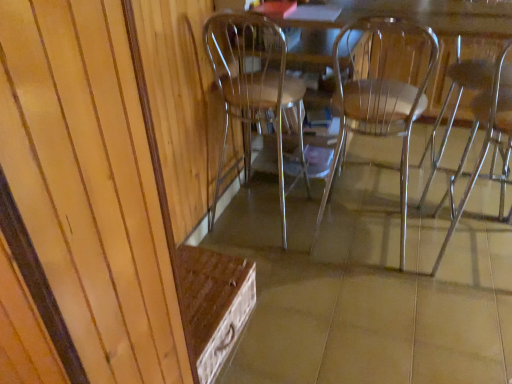
Question: Is clear plastic chair at right, positioned as the 1th chair in right-to-left order, wider than clear plastic chair at center, the third chair viewed from the right?

Choices:
 (A) no
 (B) yes

Answer: (A)

Question: Is clear plastic chair at right, positioned as the 1th chair in right-to-left order, turned away from clear plastic chair at center, the third chair viewed from the right?

Choices:
 (A) yes
 (B) no

Answer: (B)

Question: Does clear plastic chair at right, which is counted as the 4th chair, starting from the left, have a lesser height compared to clear plastic chair at center, which is the second chair from left to right?

Choices:
 (A) no
 (B) yes

Answer: (A)

Question: Considering the relative positions of clear plastic chair at right, positioned as the 1th chair in right-to-left order, and clear plastic chair at center, which is the second chair from left to right, in the image provided, is clear plastic chair at right, positioned as the 1th chair in right-to-left order, to the left of clear plastic chair at center, which is the second chair from left to right, from the viewer's perspective?

Choices:
 (A) no
 (B) yes

Answer: (A)

Question: From a real-world perspective, is clear plastic chair at right, positioned as the 1th chair in right-to-left order, under clear plastic chair at center, which is the second chair from left to right?

Choices:
 (A) yes
 (B) no

Answer: (A)

Question: Considering the positions of clear plastic chair at center, which is the second chair from left to right, and clear plastic chair at center, which is the 3th chair from left to right, in the image, is clear plastic chair at center, which is the second chair from left to right, bigger or smaller than clear plastic chair at center, which is the 3th chair from left to right,?

Choices:
 (A) big
 (B) small

Answer: (B)

Question: From the image's perspective, is clear plastic chair at center, the third chair viewed from the right, located above or below clear plastic chair at center, the 2th chair in the right-to-left sequence?

Choices:
 (A) above
 (B) below

Answer: (B)

Question: Considering the relative positions of clear plastic chair at center, the third chair viewed from the right, and clear plastic chair at center, the 2th chair in the right-to-left sequence, in the image provided, is clear plastic chair at center, the third chair viewed from the right, to the left or to the right of clear plastic chair at center, the 2th chair in the right-to-left sequence,?

Choices:
 (A) right
 (B) left

Answer: (B)

Question: From a real-world perspective, is clear plastic chair at center, which is the second chair from left to right, above or below clear plastic chair at center, which is the 3th chair from left to right?

Choices:
 (A) below
 (B) above

Answer: (B)

Question: Considering the relative positions of clear plastic chair at center, the fourth chair when ordered from right to left, and clear plastic chair at right, which is counted as the 4th chair, starting from the left, in the image provided, is clear plastic chair at center, the fourth chair when ordered from right to left, to the left or to the right of clear plastic chair at right, which is counted as the 4th chair, starting from the left,?

Choices:
 (A) left
 (B) right

Answer: (A)

Question: Considering the positions of clear plastic chair at center, the fourth chair when ordered from right to left, and clear plastic chair at right, positioned as the 1th chair in right-to-left order, in the image, is clear plastic chair at center, the fourth chair when ordered from right to left, taller or shorter than clear plastic chair at right, positioned as the 1th chair in right-to-left order,?

Choices:
 (A) short
 (B) tall

Answer: (A)

Question: Is point (214, 59) closer or farther from the camera than point (510, 112)?

Choices:
 (A) closer
 (B) farther

Answer: (A)

Question: Is clear plastic chair at center, the fourth chair when ordered from right to left, in front of or behind clear plastic chair at right, positioned as the 1th chair in right-to-left order, in the image?

Choices:
 (A) behind
 (B) front

Answer: (A)

Question: Considering the positions of clear plastic chair at center, arranged as the 1th chair when viewed from the left, and clear plastic chair at center, which is the second chair from left to right, in the image, is clear plastic chair at center, arranged as the 1th chair when viewed from the left, wider or thinner than clear plastic chair at center, which is the second chair from left to right,?

Choices:
 (A) thin
 (B) wide

Answer: (A)

Question: Would you say clear plastic chair at center, arranged as the 1th chair when viewed from the left, is inside or outside clear plastic chair at center, the third chair viewed from the right?

Choices:
 (A) outside
 (B) inside

Answer: (A)